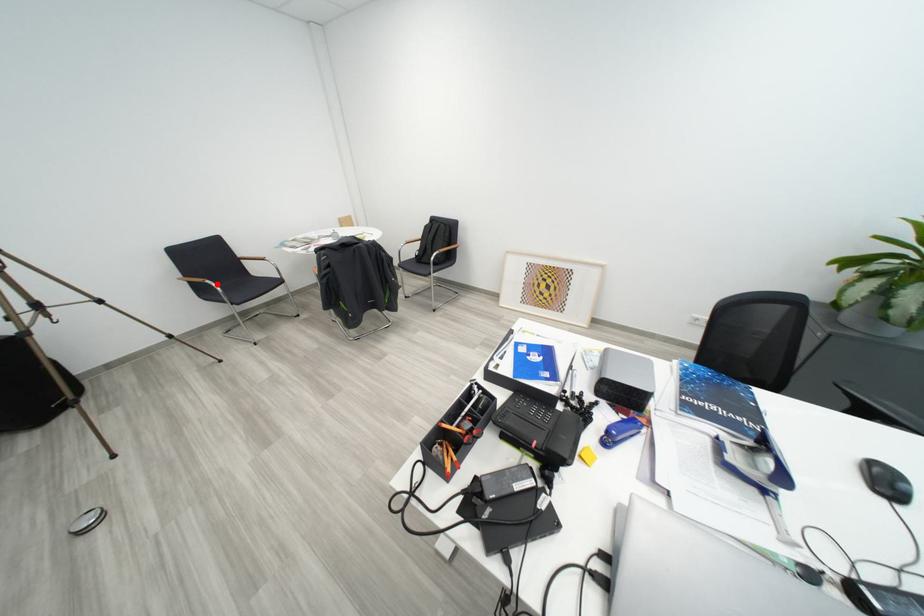
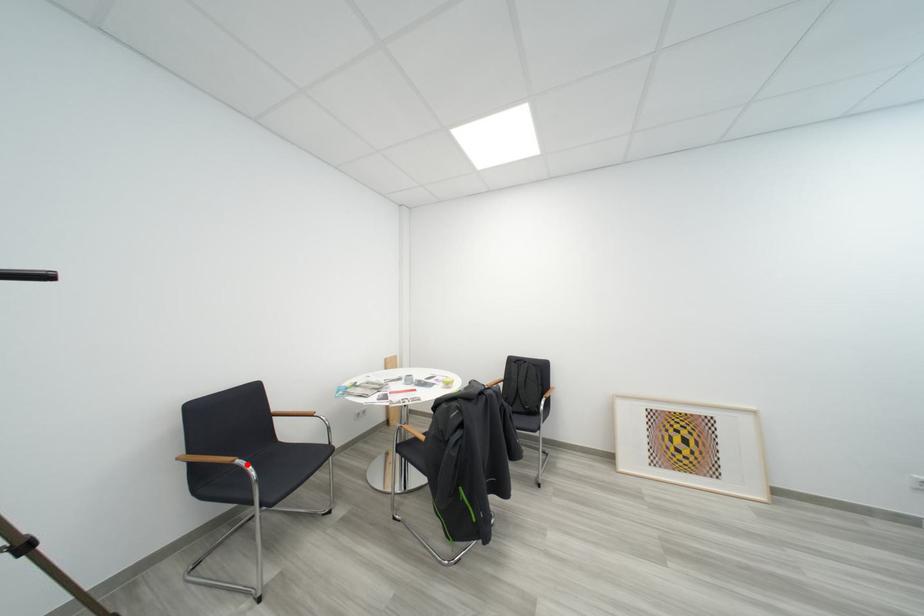
I am providing you with two images of the same scene from different viewpoints. A red point is marked on the first image and another point is marked on the second image. Are the points marked in image1 and image2 representing the same 3D position?

Yes